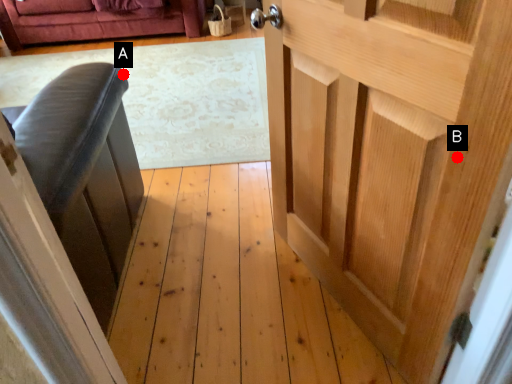
Question: Two points are circled on the image, labeled by A and B beside each circle. Which point is further to the camera?

Choices:
 (A) A is further
 (B) B is further

Answer: (A)